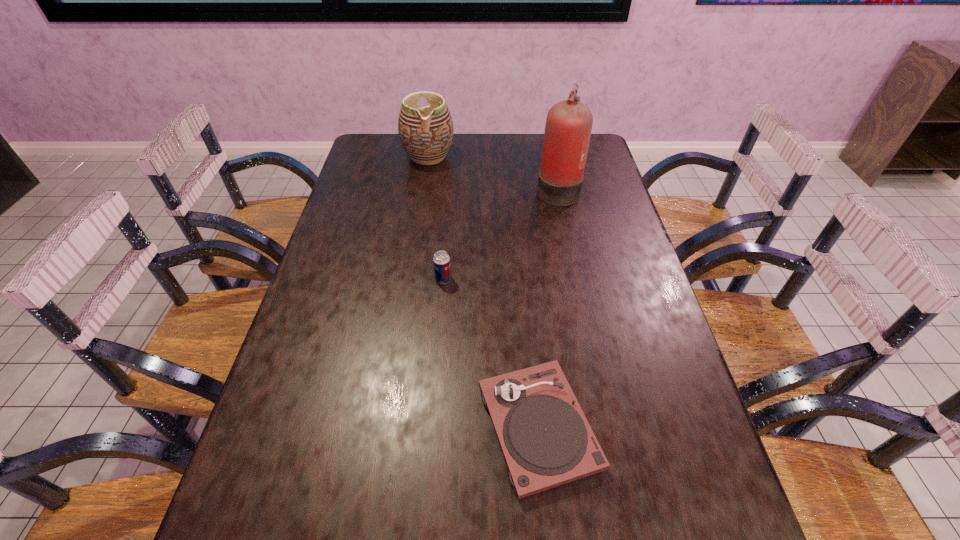
Locate an element on the screen. The image size is (960, 540). fire extinguisher is located at coordinates (568, 127).

The height and width of the screenshot is (540, 960). Identify the location of the second tallest object. click(426, 133).

Where is `the second nearest object`? The height and width of the screenshot is (540, 960). the second nearest object is located at coordinates (442, 270).

The width and height of the screenshot is (960, 540). Find the location of `the second shortest object`. the second shortest object is located at coordinates (442, 270).

In order to click on the shortest object in this screenshot , I will do `click(546, 440)`.

Where is `phonograph_record`? phonograph_record is located at coordinates (546, 440).

Identify the location of free spot located 0.240m at the nozzle of the fire extinguisher. The image size is (960, 540). pos(466,188).

You are a GUI agent. You are given a task and a screenshot of the screen. Output one action in this format:
    pyautogui.click(x=<x>, y=<y>)
    Task: Click on the vacant space situated at the nozzle of the fire extinguisher
    The height and width of the screenshot is (540, 960).
    Given the screenshot: What is the action you would take?
    pyautogui.click(x=518, y=188)

Image resolution: width=960 pixels, height=540 pixels. Find the location of `vacant region located 0.320m at the nozzle of the fire extinguisher`. vacant region located 0.320m at the nozzle of the fire extinguisher is located at coordinates (442, 188).

You are a GUI agent. You are given a task and a screenshot of the screen. Output one action in this format:
    pyautogui.click(x=<x>, y=<y>)
    Task: Click on the vacant region located on the front of the second tallest object
    The height and width of the screenshot is (540, 960).
    Given the screenshot: What is the action you would take?
    pyautogui.click(x=424, y=186)